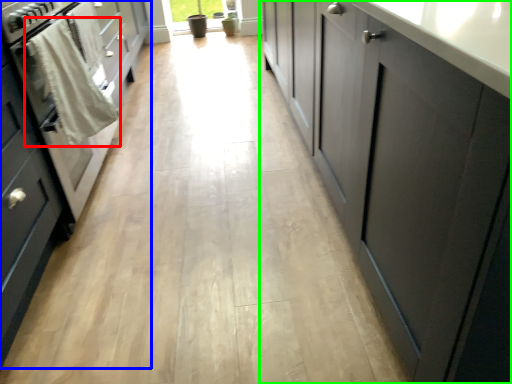
Question: Which object is positioned farthest from laundry (highlighted by a red box)? Select from cabinetry (highlighted by a blue box) and cabinetry (highlighted by a green box).

Choices:
 (A) cabinetry
 (B) cabinetry

Answer: (B)